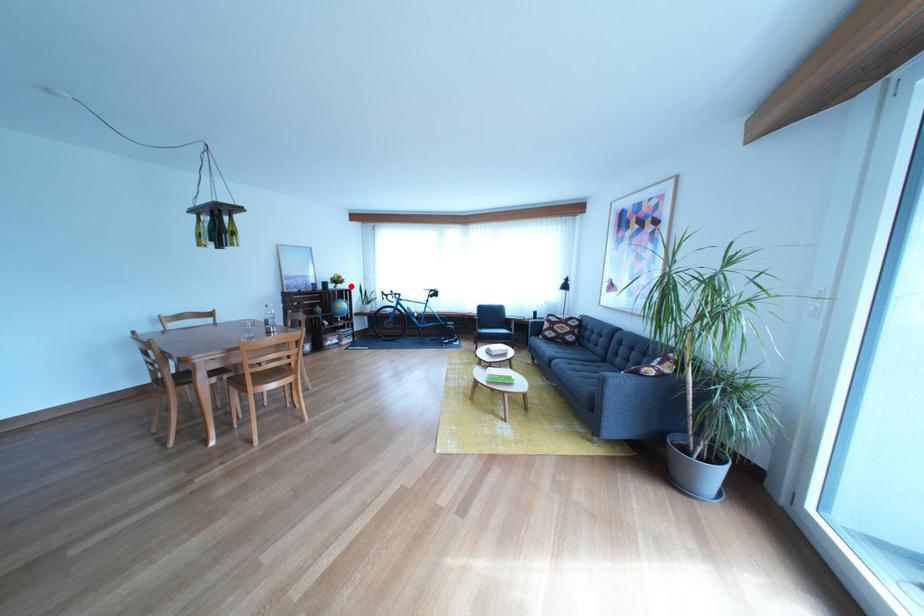
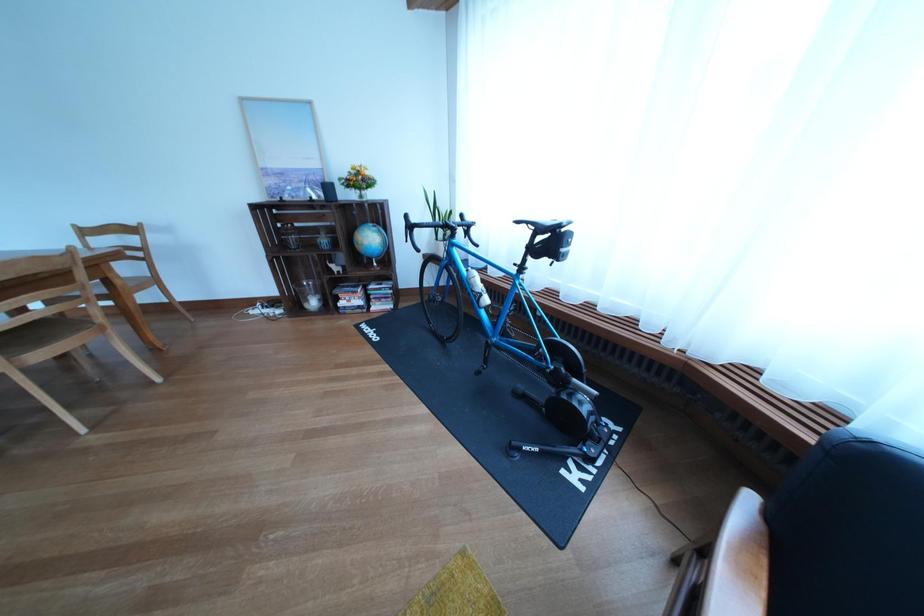
Locate, in the second image, the point that corresponds to the highlighted location in the first image.

(372, 185)